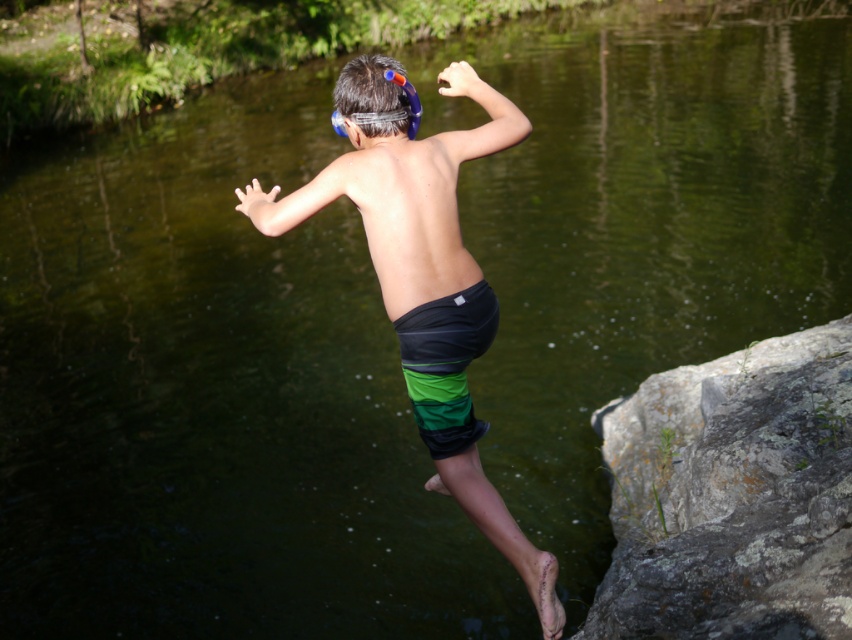
Question: Can you confirm if gray rough rock at lower right is thinner than multicolored swim trunks at center?

Choices:
 (A) no
 (B) yes

Answer: (A)

Question: Is gray rough rock at lower right positioned behind multicolored swim trunks at center?

Choices:
 (A) no
 (B) yes

Answer: (B)

Question: Based on their relative distances, which object is nearer to the gray rough rock at lower right?

Choices:
 (A) blue rubber goggles at upper center
 (B) multicolored swim trunks at center

Answer: (B)

Question: Is gray rough rock at lower right thinner than green striped shorts at center?

Choices:
 (A) no
 (B) yes

Answer: (A)

Question: Which object appears farthest from the camera in this image?

Choices:
 (A) gray rough rock at lower right
 (B) green striped shorts at center
 (C) black/stretchy fabric shorts at center

Answer: (A)

Question: Which point is closer to the camera?

Choices:
 (A) gray rough rock at lower right
 (B) green striped shorts at center
 (C) black/stretchy fabric shorts at center
 (D) multicolored swim trunks at center

Answer: (C)